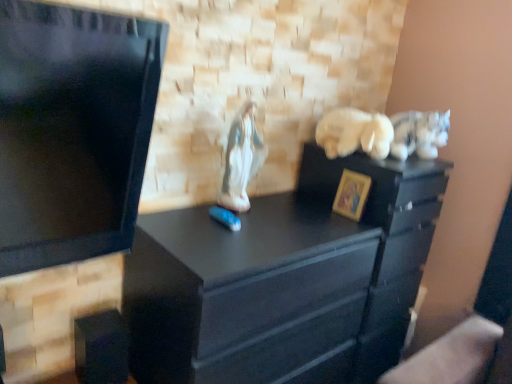
Question: From the image's perspective, is porcelain statue at center, the first animal viewed from the left, above or below black matte file cabinet at center?

Choices:
 (A) above
 (B) below

Answer: (A)

Question: Is porcelain statue at center, which is the 3th animal in right-to-left order, taller or shorter than black matte file cabinet at center?

Choices:
 (A) tall
 (B) short

Answer: (B)

Question: Estimate the real-world distances between objects in this image. Which object is farther from the porcelain statue at center, which is the 3th animal in right-to-left order?

Choices:
 (A) black matte file cabinet at center
 (B) white plush cat at upper right, which is the first animal from right to left
 (C) black matte chest of drawers at center
 (D) gold painted wood picture frame at center right
 (E) white plush bear at upper right, the 2th animal in the left-to-right sequence

Answer: (B)

Question: Which object is the closest to the white plush bear at upper right, arranged as the 2th animal when viewed from the right?

Choices:
 (A) porcelain statue at center, which is the 3th animal in right-to-left order
 (B) gold painted wood picture frame at center right
 (C) white plush cat at upper right, arranged as the third animal when viewed from the left
 (D) black matte chest of drawers at center
 (E) black matte file cabinet at center

Answer: (C)